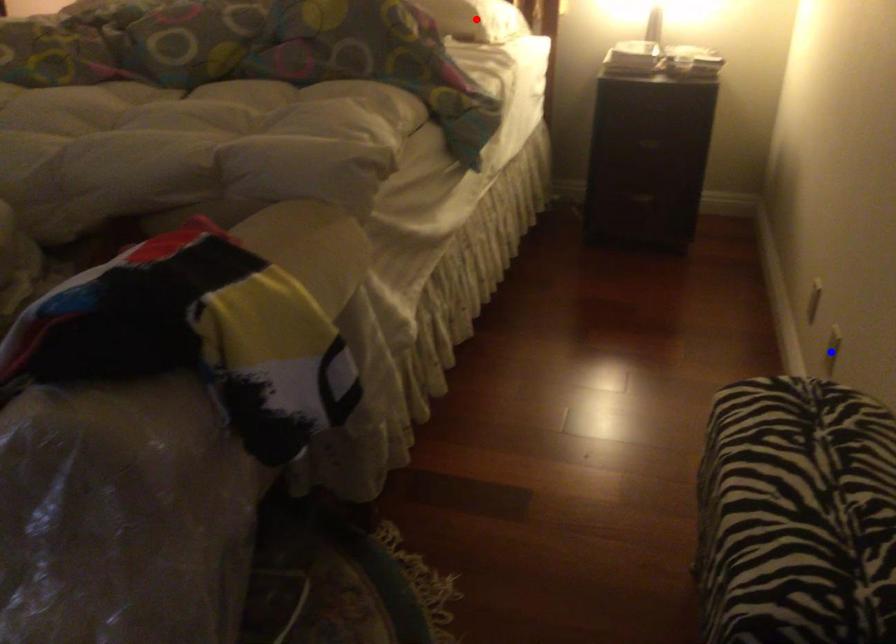
Question: Which of the two points in the image is closer to the camera?

Choices:
 (A) Blue point is closer.
 (B) Red point is closer.

Answer: (A)